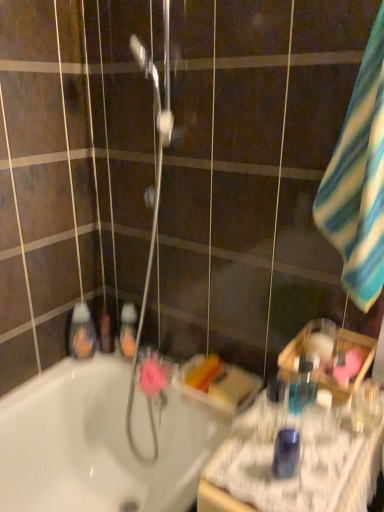
You are a GUI agent. You are given a task and a screenshot of the screen. Output one action in this format:
    pyautogui.click(x=<x>, y=<y>)
    Task: Click on the free spot in front of blue plastic mouthwash at right, which is the 6th mouthwash from back to front
    
    Given the screenshot: What is the action you would take?
    pyautogui.click(x=280, y=483)